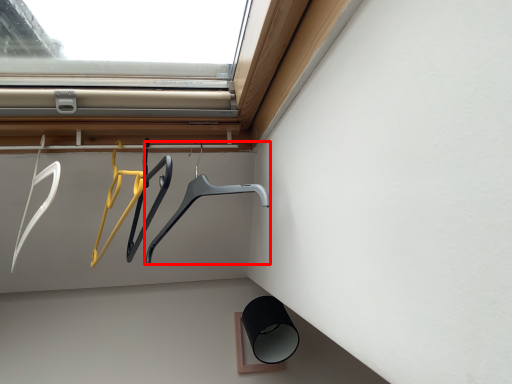
Question: In this image, where is hanger (annotated by the red box) located relative to hanger?

Choices:
 (A) left
 (B) right

Answer: (B)